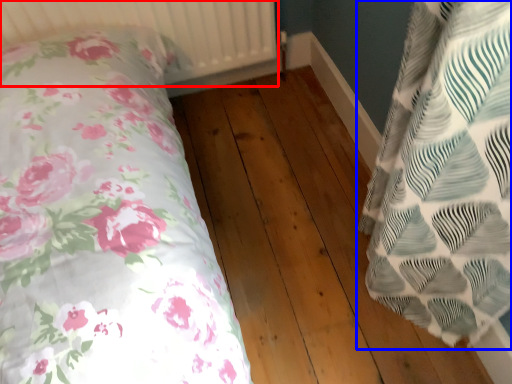
Question: Which object appears farthest to the camera in this image, radiator (highlighted by a red box) or pillow (highlighted by a blue box)?

Choices:
 (A) radiator
 (B) pillow

Answer: (A)